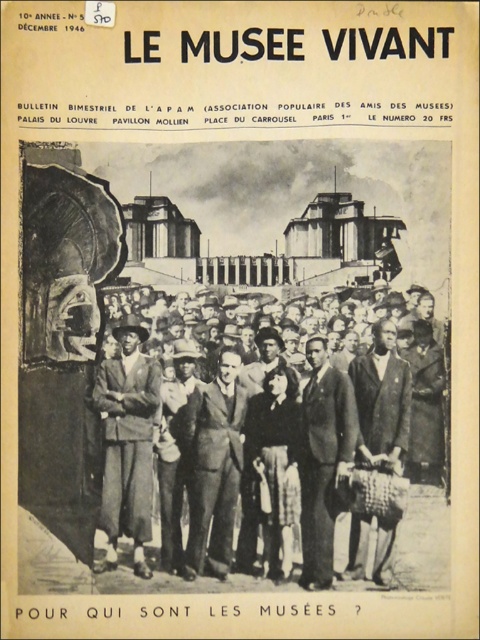
Question: Does dark brown suit at center appear on the right side of dark brown leather coat at center?

Choices:
 (A) yes
 (B) no

Answer: (B)

Question: Which point appears closest to the camera in this image?

Choices:
 (A) (186, 550)
 (B) (134, 522)
 (C) (376, 547)

Answer: (C)

Question: Does smooth suit at center have a larger size compared to dark brown leather coat at center?

Choices:
 (A) yes
 (B) no

Answer: (A)

Question: Among these points, which one is farthest from the camera?

Choices:
 (A) (385, 356)
 (B) (320, 518)
 (C) (360, 520)
 (D) (134, 532)

Answer: (A)

Question: Which object is positioned closest to the dark brown suit at center?

Choices:
 (A) smooth black suit at center
 (B) matte black suit at center
 (C) dark brown leather coat at center

Answer: (C)

Question: Does smooth suit at center appear under matte black suit at center?

Choices:
 (A) yes
 (B) no

Answer: (B)